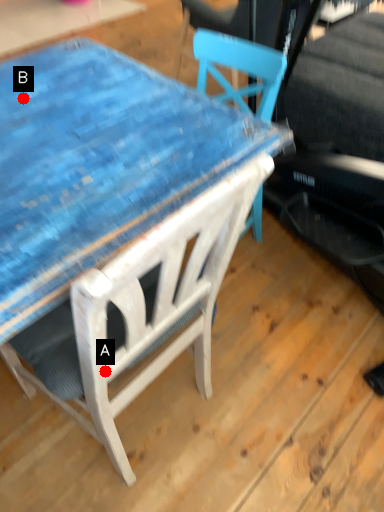
Question: Two points are circled on the image, labeled by A and B beside each circle. Which point appears closest to the camera in this image?

Choices:
 (A) A is closer
 (B) B is closer

Answer: (A)